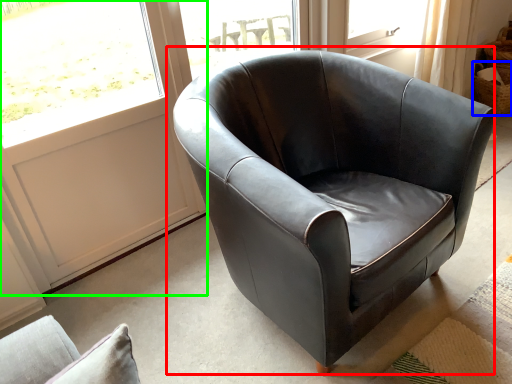
Question: Based on their relative distances, which object is farther from chair (highlighted by a red box)? Choose from basket (highlighted by a blue box) and screen door (highlighted by a green box).

Choices:
 (A) basket
 (B) screen door

Answer: (A)